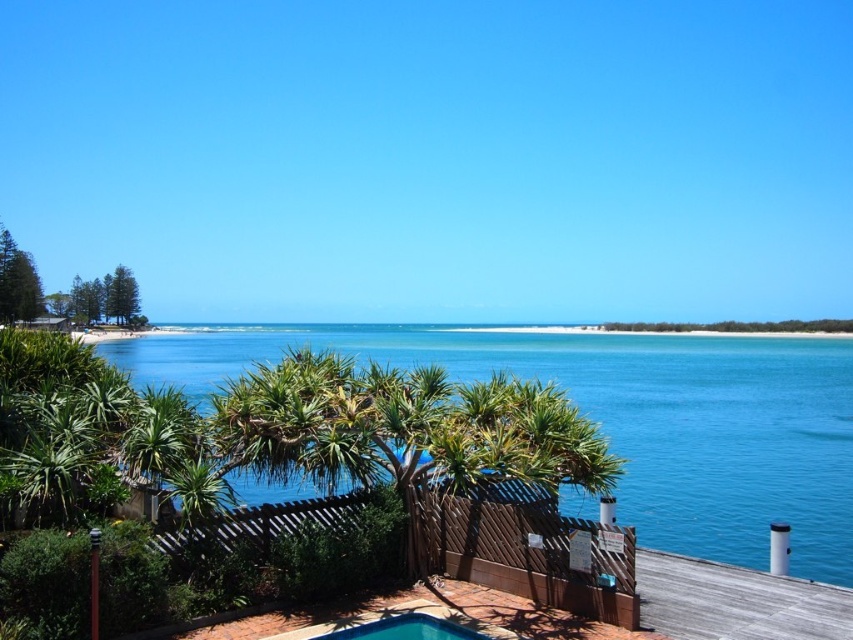
Question: Can you confirm if blue water at center is wider than blue glossy pool at lower center?

Choices:
 (A) yes
 (B) no

Answer: (A)

Question: Among these points, which one is nearest to the camera?

Choices:
 (A) (393, 637)
 (B) (461, 362)

Answer: (A)

Question: Which point is farther to the camera?

Choices:
 (A) (756, 464)
 (B) (389, 627)

Answer: (A)

Question: Does blue water at center have a greater width compared to blue glossy pool at lower center?

Choices:
 (A) yes
 (B) no

Answer: (A)

Question: Is blue water at center below blue glossy pool at lower center?

Choices:
 (A) no
 (B) yes

Answer: (A)